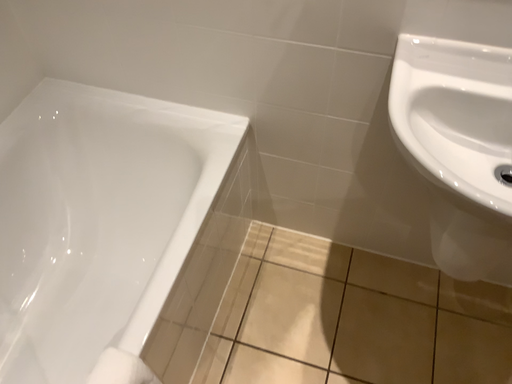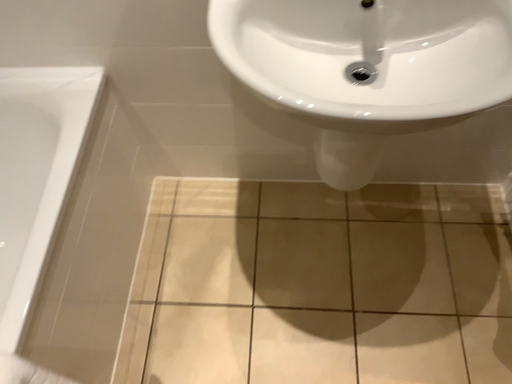
Question: Which way did the camera rotate in the video?

Choices:
 (A) rotated left
 (B) rotated right

Answer: (B)